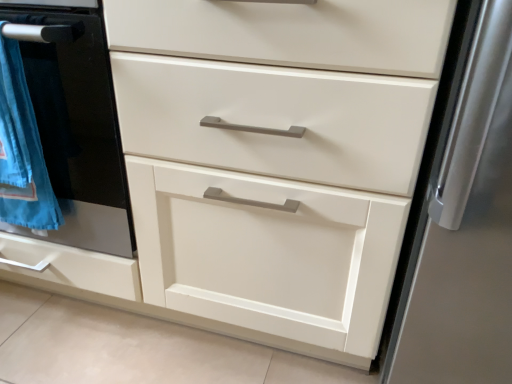
What is the approximate height of blue cotton towel at left?

The height of blue cotton towel at left is 40.42 centimeters.

What do you see at coordinates (22, 150) in the screenshot? The width and height of the screenshot is (512, 384). I see `blue cotton towel at left` at bounding box center [22, 150].

Identify the location of blue cotton towel at left. This screenshot has height=384, width=512. (22, 150).

You are a GUI agent. You are given a task and a screenshot of the screen. Output one action in this format:
    pyautogui.click(x=<x>, y=<y>)
    Task: Click on the matte black oven at left
    The height and width of the screenshot is (384, 512).
    Given the screenshot: What is the action you would take?
    pyautogui.click(x=77, y=127)

The image size is (512, 384). Describe the element at coordinates (77, 127) in the screenshot. I see `matte black oven at left` at that location.

You are a GUI agent. You are given a task and a screenshot of the screen. Output one action in this format:
    pyautogui.click(x=<x>, y=<y>)
    Task: Click on the blue cotton towel at left
    The image size is (512, 384).
    Given the screenshot: What is the action you would take?
    pyautogui.click(x=22, y=150)

From the picture: Would you say blue cotton towel at left is to the left or to the right of matte black oven at left in the picture?

From the image, it's evident that blue cotton towel at left is to the left of matte black oven at left.

Is blue cotton towel at left further to camera compared to matte black oven at left?

Yes, it is.

Considering the positions of points (3, 112) and (123, 213), is point (3, 112) farther from camera compared to point (123, 213)?

No, it is not.

From the image's perspective, between blue cotton towel at left and matte black oven at left, who is located below?

From the image's view, blue cotton towel at left is below.

In the scene shown: From a real-world perspective, which is physically above, blue cotton towel at left or matte black oven at left?

In real-world perspective, blue cotton towel at left is above.

Between blue cotton towel at left and matte black oven at left, which one has larger width?

matte black oven at left.

Which of these two, blue cotton towel at left or matte black oven at left, stands shorter?

blue cotton towel at left is shorter.

Between blue cotton towel at left and matte black oven at left, which one has smaller size?

blue cotton towel at left is smaller.

Does blue cotton towel at left contain matte black oven at left?

No, matte black oven at left is not surrounded by blue cotton towel at left.

Would you consider blue cotton towel at left to be distant from matte black oven at left?

No.

Is blue cotton towel at left aimed at matte black oven at left?

No.

How different are the orientations of blue cotton towel at left and matte black oven at left in degrees?

They differ by 0.000642 degrees in their facing directions.

How much distance is there between blue cotton towel at left and matte black oven at left?

The distance of blue cotton towel at left from matte black oven at left is 2.70 inches.

The width and height of the screenshot is (512, 384). Find the location of `blanket lying behind the matte black oven at left`. blanket lying behind the matte black oven at left is located at coordinates (22, 150).

Visually, is matte black oven at left positioned to the left or to the right of blue cotton towel at left?

Clearly, matte black oven at left is on the right of blue cotton towel at left in the image.

Based on the photo, in the image, is matte black oven at left positioned in front of or behind blue cotton towel at left?

matte black oven at left is positioned closer to the viewer than blue cotton towel at left.

Does point (61, 195) appear closer or farther from the camera than point (7, 64)?

Point (61, 195) appears to be farther away from the viewer than point (7, 64).

From the image's perspective, is matte black oven at left located above or below blue cotton towel at left?

Based on their image positions, matte black oven at left is located above blue cotton towel at left.

From a real-world perspective, which object rests below the other?

matte black oven at left is physically lower.

Is matte black oven at left thinner than blue cotton towel at left?

No.

Does matte black oven at left have a greater height compared to blue cotton towel at left?

Yes, matte black oven at left is taller than blue cotton towel at left.

Between matte black oven at left and blue cotton towel at left, which one has smaller size?

blue cotton towel at left.

Would you say matte black oven at left is inside or outside blue cotton towel at left?

matte black oven at left is not inside blue cotton towel at left, it's outside.

Are matte black oven at left and blue cotton towel at left beside each other?

Yes, matte black oven at left is touching blue cotton towel at left.

Could you tell me if matte black oven at left is turned towards blue cotton towel at left?

Yes, matte black oven at left faces towards blue cotton towel at left.

What's the angular difference between matte black oven at left and blue cotton towel at left's facing directions?

The angle between the facing direction of matte black oven at left and the facing direction of blue cotton towel at left is 0.000642 degrees.

Identify the location of blanket that appears on the left of matte black oven at left. This screenshot has height=384, width=512. (22, 150).

Identify the location of blanket behind the matte black oven at left. [22, 150].

Where is `oven in front of the blue cotton towel at left`? The image size is (512, 384). oven in front of the blue cotton towel at left is located at coordinates (77, 127).